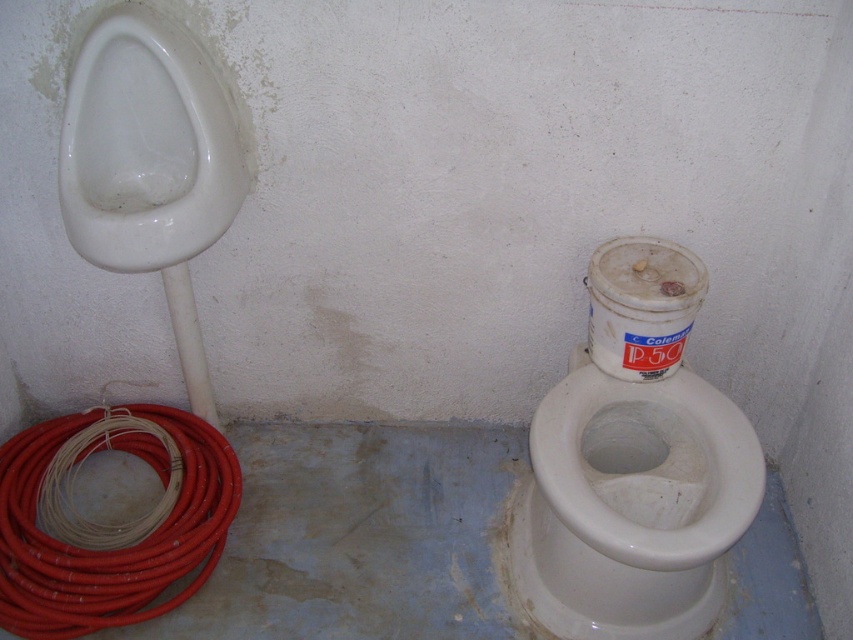
You are a maintenance worker in a restroom. You need to check the connection between the white glossy urinal at left and the red rubber hose at lower left. Which object should you approach first to inspect the connection properly?

The white glossy urinal at left is in front of the red rubber hose at lower left, so you should approach the white glossy urinal at left first to inspect the connection properly.

You are standing in the restroom and want to use the toilet. The urinal is on the left, and the toilet is at the lower right. Which fixture is closer to the point marked at coordinates (631, 504)?

The point marked at coordinates (631, 504) indicates the white glossy toilet bowl at lower right, so the toilet is closer to that point.